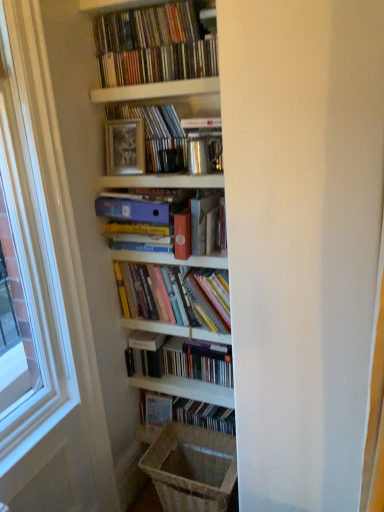
Question: Is matte black books at center, which is counted as the 1th book, starting from the bottom, turned away from brown woven laundry basket at lower center?

Choices:
 (A) no
 (B) yes

Answer: (A)

Question: Is brown woven laundry basket at lower center surrounded by matte black books at center, which is counted as the 1th book, starting from the bottom?

Choices:
 (A) yes
 (B) no

Answer: (B)

Question: Considering the relative positions of matte black books at center, which is counted as the 1th book, starting from the bottom, and brown woven laundry basket at lower center in the image provided, is matte black books at center, which is counted as the 1th book, starting from the bottom, to the left of brown woven laundry basket at lower center from the viewer's perspective?

Choices:
 (A) no
 (B) yes

Answer: (A)

Question: Does matte black books at center, which is counted as the 1th book, starting from the bottom, have a greater height compared to brown woven laundry basket at lower center?

Choices:
 (A) no
 (B) yes

Answer: (B)

Question: Is matte black books at center, which is counted as the 1th book, starting from the bottom, oriented towards brown woven laundry basket at lower center?

Choices:
 (A) yes
 (B) no

Answer: (A)

Question: Looking at their shapes, would you say hardcover books at center, which is counted as the 4th book, starting from the top, is wider or thinner than matte black books at center, the 6th book positioned from the top?

Choices:
 (A) wide
 (B) thin

Answer: (A)

Question: Would you say hardcover books at center, which is counted as the 4th book, starting from the top, is to the left or to the right of matte black books at center, which is counted as the 1th book, starting from the bottom, in the picture?

Choices:
 (A) left
 (B) right

Answer: (A)

Question: Considering the positions of hardcover books at center, which is counted as the 4th book, starting from the top, and matte black books at center, the 6th book positioned from the top, in the image, is hardcover books at center, which is counted as the 4th book, starting from the top, bigger or smaller than matte black books at center, the 6th book positioned from the top,?

Choices:
 (A) small
 (B) big

Answer: (B)

Question: From the image's perspective, is hardcover books at center, which ranks as the third book in bottom-to-top order, located above or below matte black books at center, the 6th book positioned from the top?

Choices:
 (A) below
 (B) above

Answer: (B)

Question: Looking at their shapes, would you say matte plastic cds at upper center, the 6th book positioned from the bottom, is wider or thinner than white glossy shelf at upper center?

Choices:
 (A) wide
 (B) thin

Answer: (B)

Question: Considering the positions of point (127, 23) and point (160, 94), is point (127, 23) closer or farther from the camera than point (160, 94)?

Choices:
 (A) closer
 (B) farther

Answer: (B)

Question: From the image's perspective, is matte plastic cds at upper center, the 6th book positioned from the bottom, positioned above or below white glossy shelf at upper center?

Choices:
 (A) below
 (B) above

Answer: (B)

Question: Visually, is matte plastic cds at upper center, acting as the first book starting from the top, positioned to the left or to the right of white glossy shelf at upper center?

Choices:
 (A) right
 (B) left

Answer: (B)

Question: Based on their sizes in the image, would you say matte pink paperback at center is bigger or smaller than matte plastic folder at center, which ranks as the 4th book in bottom-to-top order?

Choices:
 (A) big
 (B) small

Answer: (B)

Question: Considering their positions, is matte pink paperback at center located in front of or behind matte plastic folder at center, which ranks as the 3th book in top-to-bottom order?

Choices:
 (A) front
 (B) behind

Answer: (A)